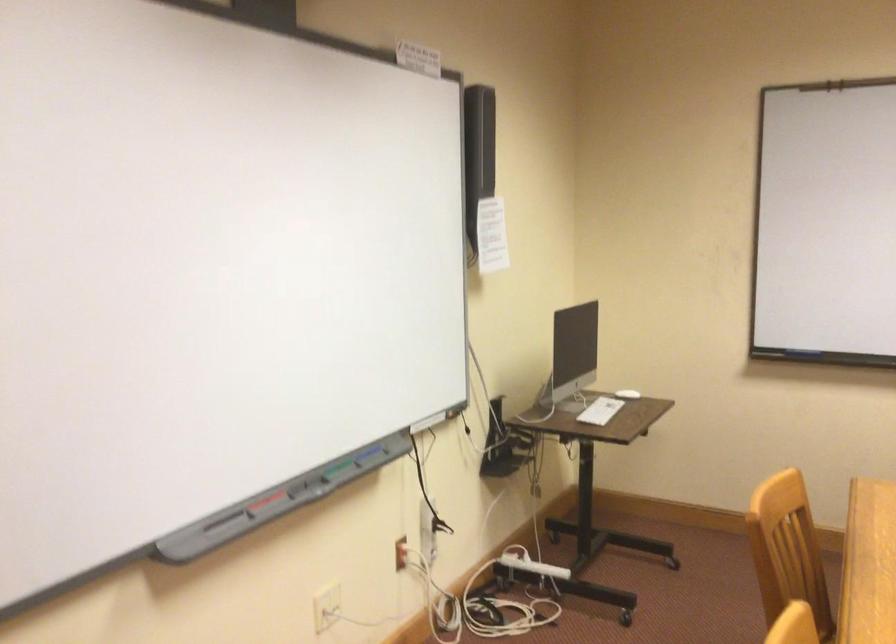
Identify the location of grey whiteboard eraser. (302, 484).